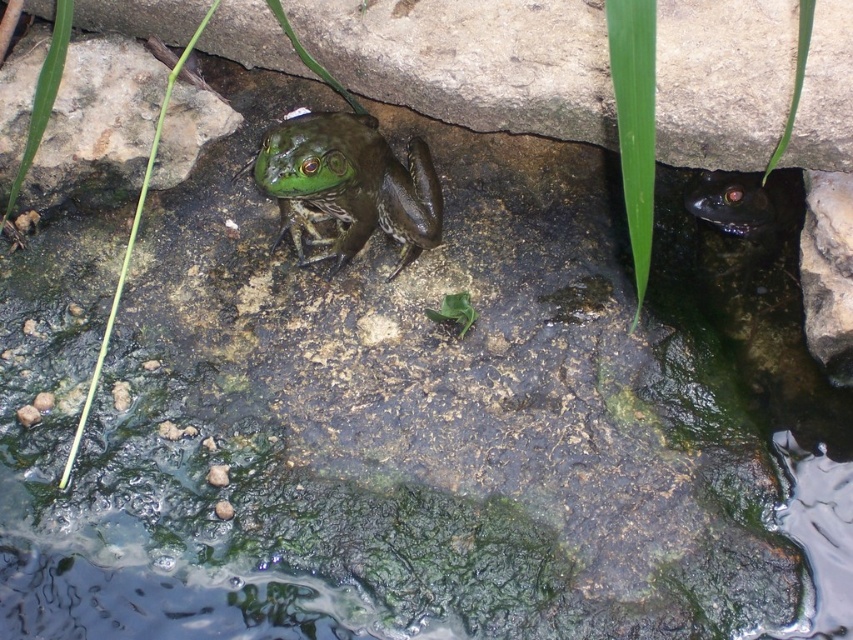
Identify the location of green rough stone at center. The width and height of the screenshot is (853, 640). (473, 60).

What do you see at coordinates (473, 60) in the screenshot? Image resolution: width=853 pixels, height=640 pixels. I see `green rough stone at center` at bounding box center [473, 60].

You are a GUI agent. You are given a task and a screenshot of the screen. Output one action in this format:
    pyautogui.click(x=<x>, y=<y>)
    Task: Click on the green rough stone at center
    
    Given the screenshot: What is the action you would take?
    pos(473,60)

Is point (79, 124) positioned behind point (323, 168)?

Yes, it is.

Between green rough stone at upper center and green matte/frothy frog at center, which one is positioned higher?

green rough stone at upper center is higher up.

Locate an element on the screen. green rough stone at upper center is located at coordinates 97,120.

You are a GUI agent. You are given a task and a screenshot of the screen. Output one action in this format:
    pyautogui.click(x=<x>, y=<y>)
    Task: Click on the green rough stone at upper center
    
    Given the screenshot: What is the action you would take?
    pyautogui.click(x=97, y=120)

Is the position of green rough stone at center more distant than that of green rough stone at upper center?

No, it is not.

Who is more forward, (379,93) or (143,106)?

Point (143,106)

The image size is (853, 640). What are the coordinates of `green rough stone at center` in the screenshot? It's located at (473, 60).